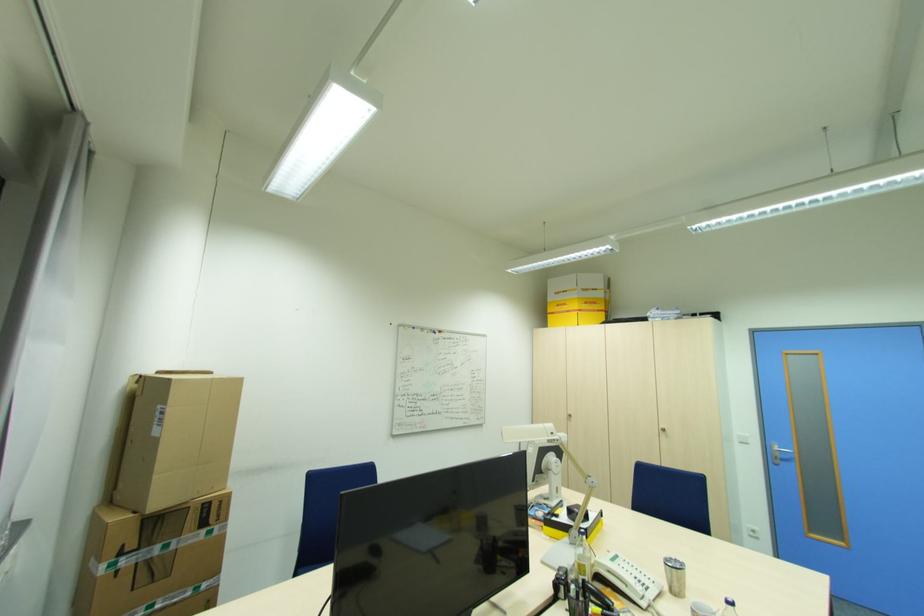
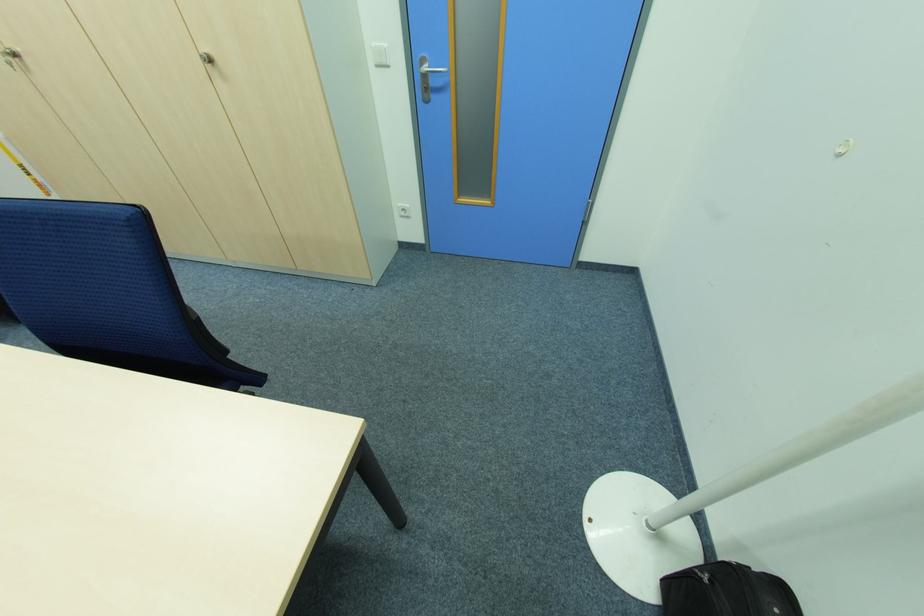
Locate, in the second image, the point that corresponds to pixel 756 531 in the first image.

(407, 209)